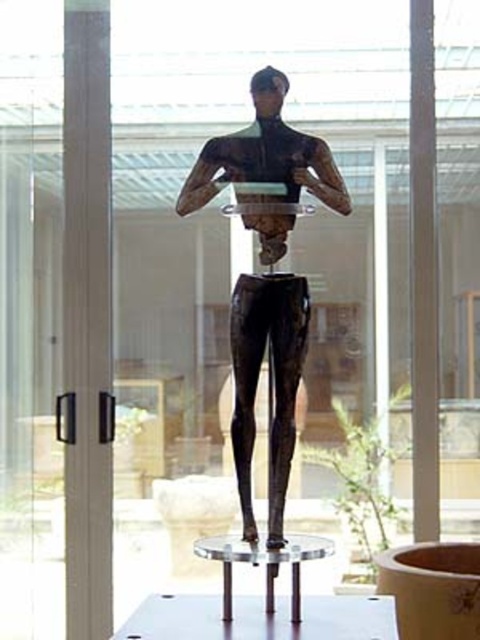
Question: Which object is the farthest from the white glossy table at center?

Choices:
 (A) clear acrylic table at center
 (B) green leafy plant at lower center
 (C) bronze statue at center

Answer: (B)

Question: Which object is positioned farthest from the clear acrylic table at center?

Choices:
 (A) white glossy table at center
 (B) green leafy plant at lower center
 (C) bronze statue at center

Answer: (B)

Question: Can you confirm if bronze statue at center is smaller than white glossy table at center?

Choices:
 (A) yes
 (B) no

Answer: (B)

Question: Is bronze statue at center positioned before clear acrylic table at center?

Choices:
 (A) no
 (B) yes

Answer: (A)

Question: Which object appears closest to the camera in this image?

Choices:
 (A) white glossy table at center
 (B) clear acrylic table at center
 (C) bronze statue at center
 (D) green leafy plant at lower center

Answer: (A)

Question: Is green leafy plant at lower center further to the viewer compared to clear acrylic table at center?

Choices:
 (A) no
 (B) yes

Answer: (B)